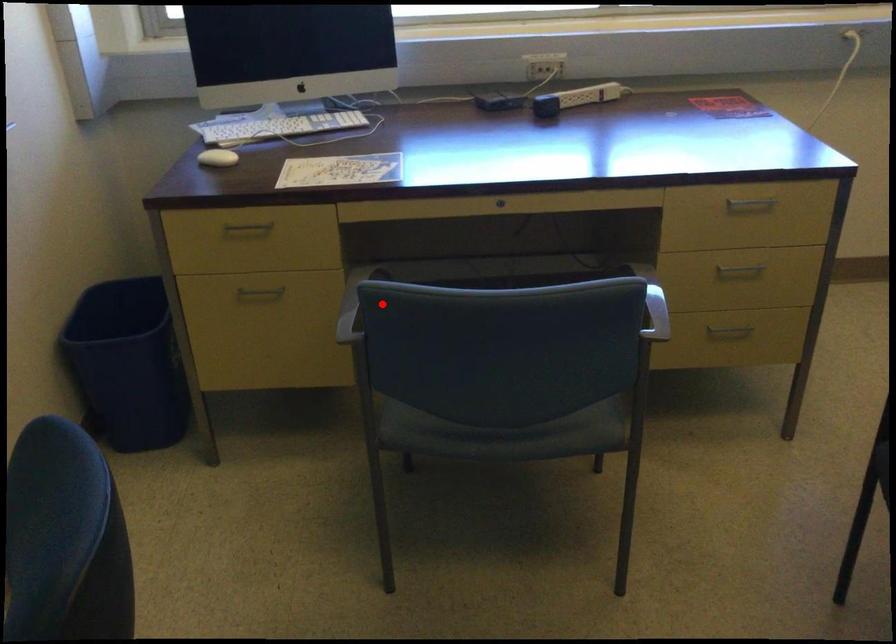
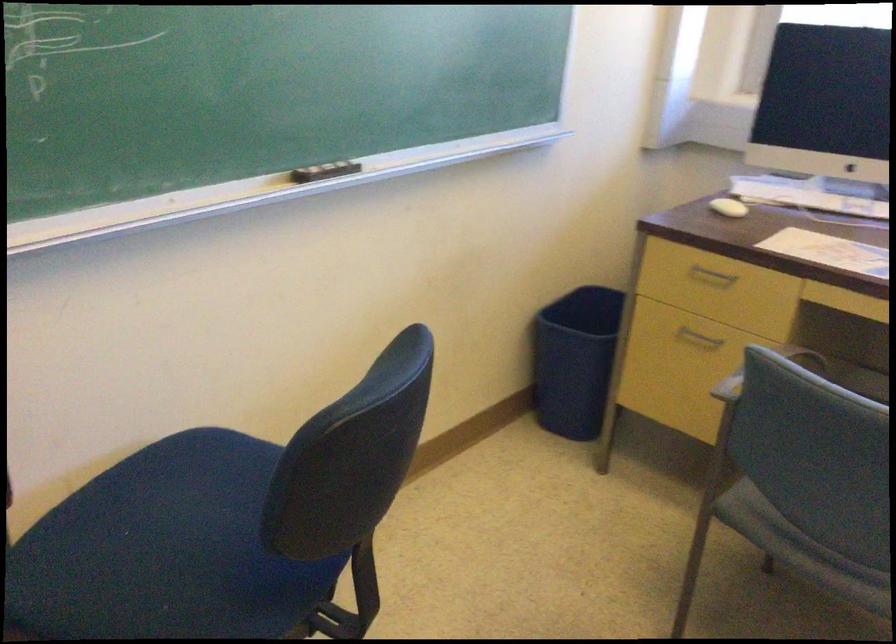
Locate, in the second image, the point that corresponds to the highlighted location in the first image.

(764, 371)